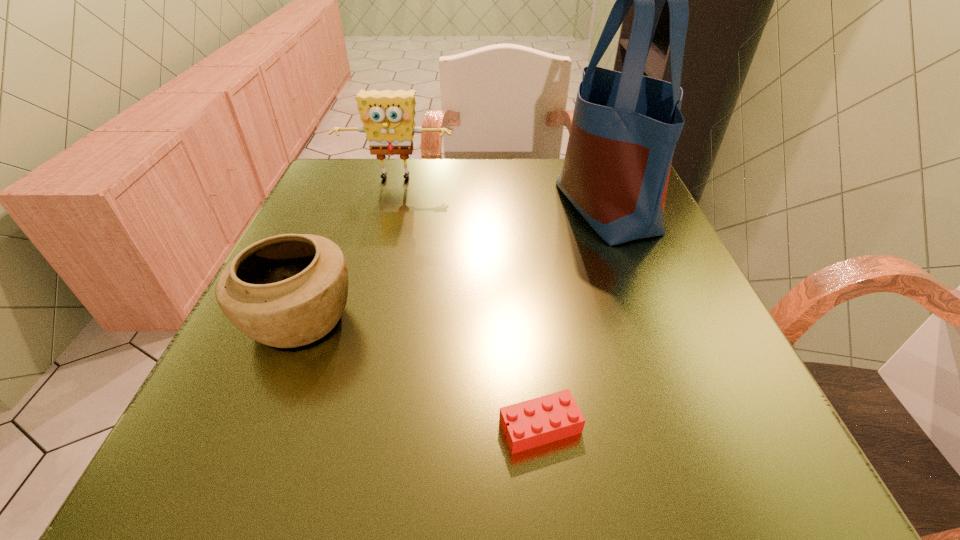
Locate an element on the screen. free space located 0.190m on the left of the shortest object is located at coordinates (355, 427).

Locate an element on the screen. handbag that is at the far edge is located at coordinates (625, 126).

Where is `sponge located in the far edge section of the desktop`? The height and width of the screenshot is (540, 960). sponge located in the far edge section of the desktop is located at coordinates (388, 116).

Image resolution: width=960 pixels, height=540 pixels. In order to click on object at the near edge in this screenshot , I will do `click(535, 422)`.

Locate an element on the screen. The height and width of the screenshot is (540, 960). sponge located in the left edge section of the desktop is located at coordinates (388, 116).

The image size is (960, 540). I want to click on pottery at the left edge, so click(285, 291).

Find the location of a particular element. This screenshot has height=540, width=960. object that is positioned at the right edge is located at coordinates (625, 126).

What are the coordinates of `object at the far left corner` in the screenshot? It's located at (388, 116).

Locate an element on the screen. The height and width of the screenshot is (540, 960). object present at the far right corner is located at coordinates pyautogui.click(x=625, y=126).

Identify the location of blank space at the far edge of the desktop. This screenshot has width=960, height=540. coord(398,189).